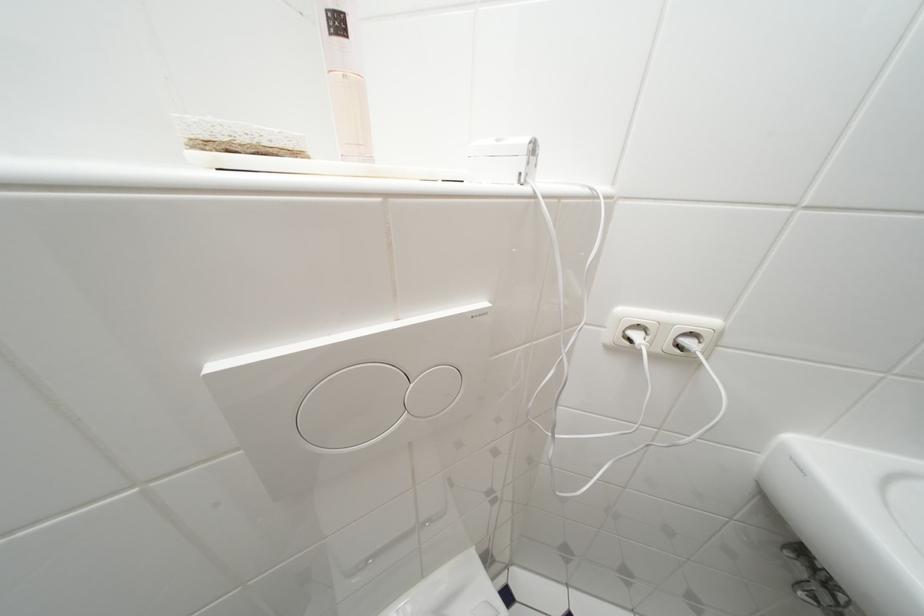
At what (x,y) coordinates should I click in order to perform the action: click on small flush button. Please return your answer as a coordinate pair (x, y). Looking at the image, I should click on (432, 391).